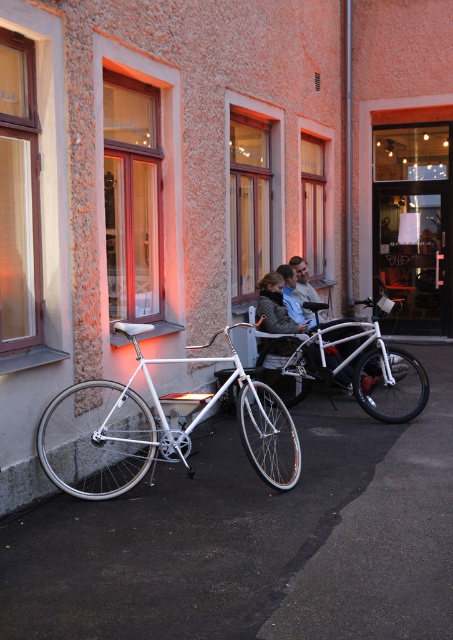
Question: Is white metallic bicycle at left to the right of white matte bicycle at center from the viewer's perspective?

Choices:
 (A) no
 (B) yes

Answer: (A)

Question: Does transparent glass door at center have a larger size compared to white matte bicycle at center?

Choices:
 (A) no
 (B) yes

Answer: (A)

Question: Considering the real-world distances, which object is farthest from the matte white bicycle at center?

Choices:
 (A) matte gray jacket at center
 (B) white matte bicycle at center
 (C) transparent glass door at center

Answer: (C)

Question: Among these points, which one is farthest from the camera?

Choices:
 (A) (400, 403)
 (B) (282, 397)
 (C) (409, 134)

Answer: (C)

Question: Observing the image, what is the correct spatial positioning of white metallic bicycle at left in reference to matte gray jacket at center?

Choices:
 (A) left
 (B) right

Answer: (A)

Question: Among these objects, which one is nearest to the camera?

Choices:
 (A) transparent glass door at center
 (B) white metallic bicycle at left

Answer: (B)